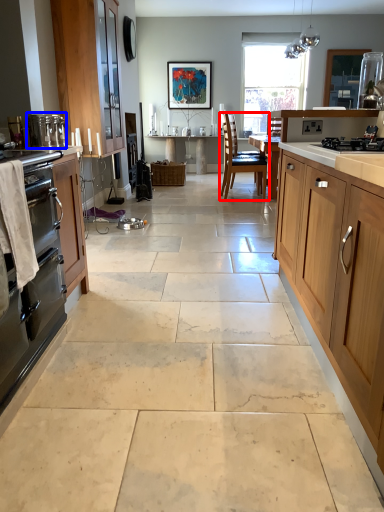
Question: Which object appears closest to the camera in this image, chair (highlighted by a red box) or appliance (highlighted by a blue box)?

Choices:
 (A) chair
 (B) appliance

Answer: (B)